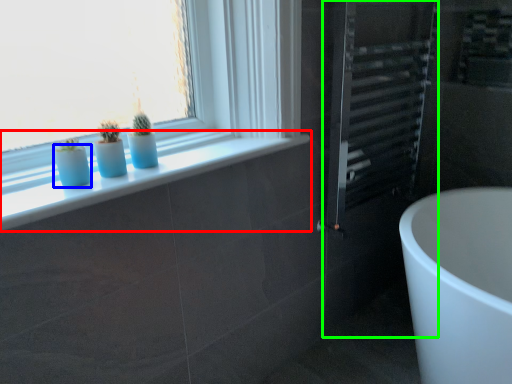
Question: Which object is the closest to the window sill (highlighted by a red box)? Choose among these: glass vase (highlighted by a blue box) or screen door (highlighted by a green box).

Choices:
 (A) glass vase
 (B) screen door

Answer: (A)